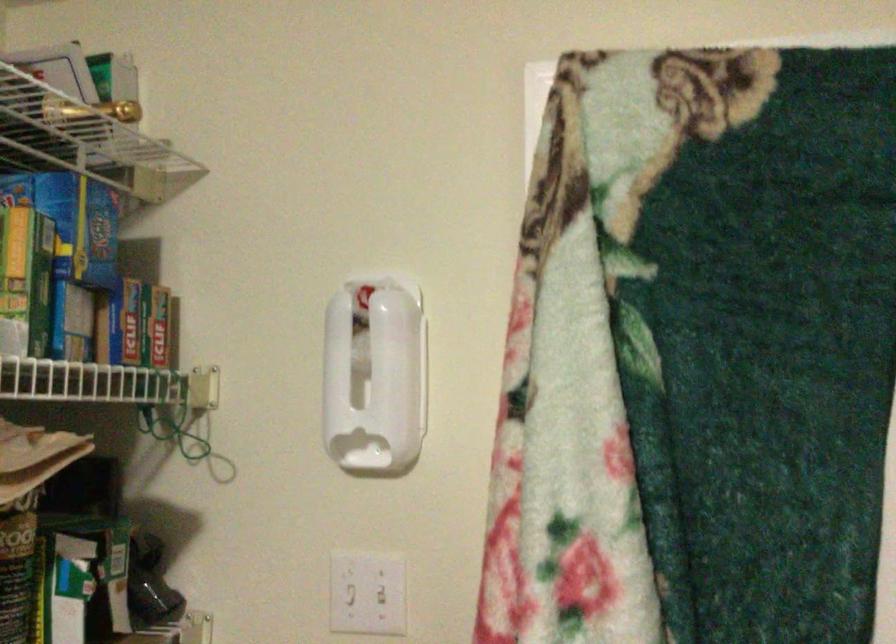
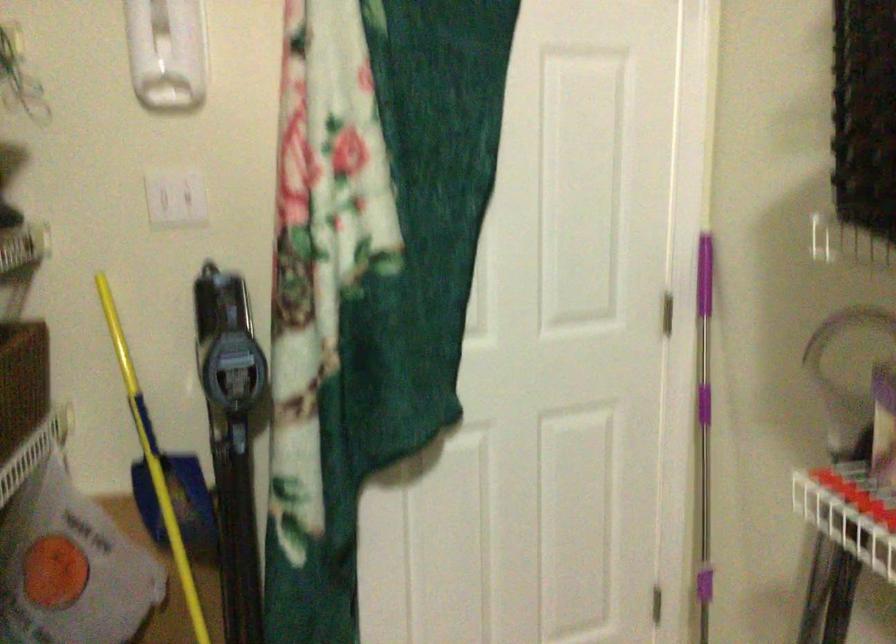
Looking at this image, based on the continuous images, in which direction is the camera rotating?

The rotation direction of the camera is right-down.